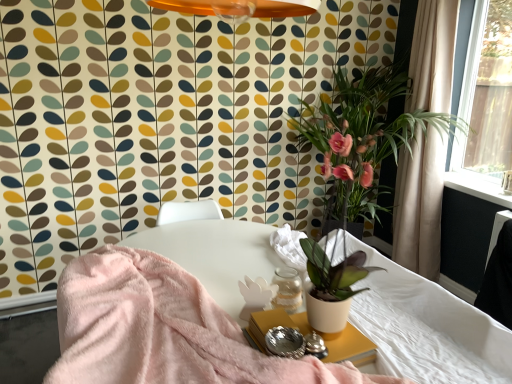
The width and height of the screenshot is (512, 384). In order to click on white fabric mattress at lower right in this screenshot , I will do `click(426, 327)`.

I want to click on white matte side table at lower center, so click(x=350, y=347).

This screenshot has height=384, width=512. What are the coordinates of `beige fabric curtain at right` in the screenshot? It's located at (420, 204).

What do you see at coordinates (362, 138) in the screenshot? This screenshot has height=384, width=512. I see `matte white pot at center` at bounding box center [362, 138].

Where is `white fabric mattress at lower right`? The image size is (512, 384). white fabric mattress at lower right is located at coordinates (426, 327).

Which object is positioned more to the left, matte white pot at center or beige fabric curtain at right?

matte white pot at center.

Can you confirm if matte white pot at center is shorter than beige fabric curtain at right?

No.

Where is `houseplant that appears in front of the beige fabric curtain at right`? houseplant that appears in front of the beige fabric curtain at right is located at coordinates (362, 138).

Relative to white fabric mattress at lower right, is beige fabric curtain at right in front or behind?

Visually, beige fabric curtain at right is located behind white fabric mattress at lower right.

Is beige fabric curtain at right not close to white fabric mattress at lower right?

beige fabric curtain at right is far away from white fabric mattress at lower right.

From a real-world perspective, is beige fabric curtain at right on top of white fabric mattress at lower right?

Indeed, from a real-world perspective, beige fabric curtain at right stands above white fabric mattress at lower right.

From a real-world perspective, is white matte side table at lower center positioned above or below beige fabric curtain at right?

Clearly, from a real-world perspective, white matte side table at lower center is below beige fabric curtain at right.

Can beige fabric curtain at right be found inside white matte side table at lower center?

No.

Measure the distance from white matte side table at lower center to beige fabric curtain at right.

A distance of 1.97 meters exists between white matte side table at lower center and beige fabric curtain at right.

Is white matte side table at lower center oriented towards beige fabric curtain at right?

No.

From a real-world perspective, which is physically below, white matte side table at lower center or white fabric mattress at lower right?

white fabric mattress at lower right is physically lower.

Where is `side table located in front of the white fabric mattress at lower right`? This screenshot has height=384, width=512. side table located in front of the white fabric mattress at lower right is located at coordinates (350, 347).

Does white matte side table at lower center lie in front of white fabric mattress at lower right?

Yes, white matte side table at lower center is closer to the viewer.

Is white matte side table at lower center oriented away from white fabric mattress at lower right?

Absolutely, white matte side table at lower center is directed away from white fabric mattress at lower right.

Are beige fabric curtain at right and matte white pot at center located far from each other?

Actually, beige fabric curtain at right and matte white pot at center are a little close together.

Does point (431, 108) come farther from viewer compared to point (362, 169)?

That is True.

Which is in front, beige fabric curtain at right or matte white pot at center?

matte white pot at center is closer to the camera.

Is white matte side table at lower center at the back of matte white pot at center?

No, matte white pot at center is not facing the opposite direction of white matte side table at lower center.

Is matte white pot at center not near white matte side table at lower center?

matte white pot at center is far away from white matte side table at lower center.

Which object is further away from the camera taking this photo, matte white pot at center or white matte side table at lower center?

matte white pot at center is further from the camera.

Looking at their sizes, would you say white fabric mattress at lower right is wider or thinner than matte white pot at center?

Considering their sizes, white fabric mattress at lower right looks slimmer than matte white pot at center.

Is white fabric mattress at lower right positioned behind matte white pot at center?

No, white fabric mattress at lower right is closer to the camera.

Consider the image. Is white fabric mattress at lower right facing towards matte white pot at center?

No, white fabric mattress at lower right is not aimed at matte white pot at center.

In the image, there is a white fabric mattress at lower right. Where is `houseplant above it (from the image's perspective)`? This screenshot has height=384, width=512. houseplant above it (from the image's perspective) is located at coordinates (362, 138).

Identify the location of houseplant on the left of beige fabric curtain at right. [x=362, y=138].

Locate an element on the screen. curtain behind the white fabric mattress at lower right is located at coordinates (420, 204).

When comparing their distances from white matte side table at lower center, does beige fabric curtain at right or matte white pot at center seem closer?

matte white pot at center is positioned closer to the anchor white matte side table at lower center.

Based on their spatial positions, is beige fabric curtain at right or white matte side table at lower center closer to matte white pot at center?

beige fabric curtain at right is closer to matte white pot at center.

Estimate the real-world distances between objects in this image. Which object is closer to matte white pot at center, white fabric mattress at lower right or white matte side table at lower center?

white fabric mattress at lower right is closer to matte white pot at center.

Considering their positions, is white matte side table at lower center positioned further to beige fabric curtain at right than white fabric mattress at lower right?

white matte side table at lower center.

When comparing their distances from matte white pot at center, does white matte side table at lower center or beige fabric curtain at right seem closer?

beige fabric curtain at right is closer to matte white pot at center.

Considering their positions, is beige fabric curtain at right positioned further to white fabric mattress at lower right than matte white pot at center?

Among the two, beige fabric curtain at right is located further to white fabric mattress at lower right.

Which object lies nearer to the anchor point white matte side table at lower center, matte white pot at center or beige fabric curtain at right?

matte white pot at center lies closer to white matte side table at lower center than the other object.

When comparing their distances from matte white pot at center, does white matte side table at lower center or white fabric mattress at lower right seem further?

white matte side table at lower center is positioned further to the anchor matte white pot at center.

Locate an element on the screen. houseplant between white matte side table at lower center and beige fabric curtain at right in the front-back direction is located at coordinates (362, 138).

Locate an element on the screen. Image resolution: width=512 pixels, height=384 pixels. houseplant between white fabric mattress at lower right and beige fabric curtain at right in the front-back direction is located at coordinates (362, 138).

Where is `mattress positioned between white matte side table at lower center and beige fabric curtain at right from near to far`? Image resolution: width=512 pixels, height=384 pixels. mattress positioned between white matte side table at lower center and beige fabric curtain at right from near to far is located at coordinates (426, 327).

Locate an element on the screen. The height and width of the screenshot is (384, 512). mattress between white matte side table at lower center and matte white pot at center along the z-axis is located at coordinates (426, 327).